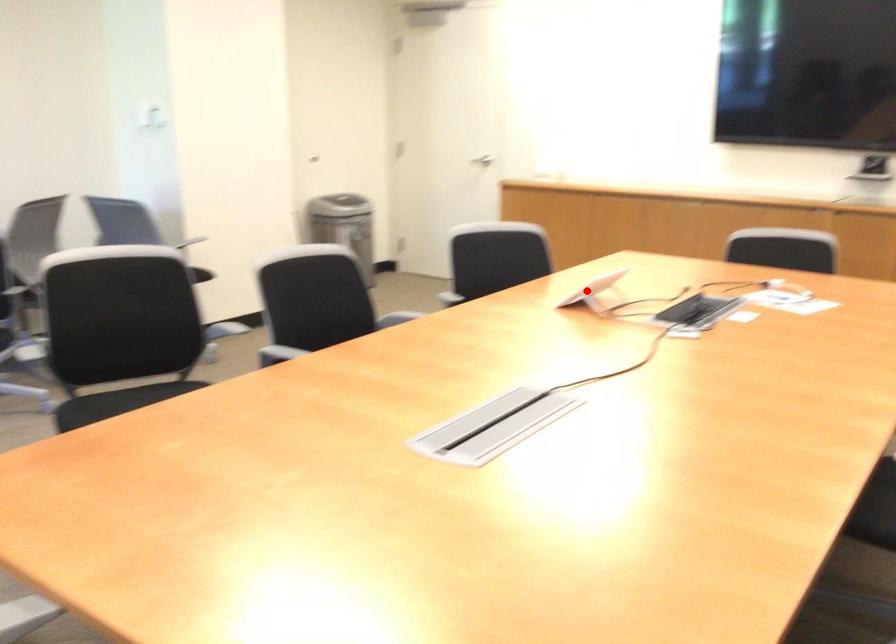
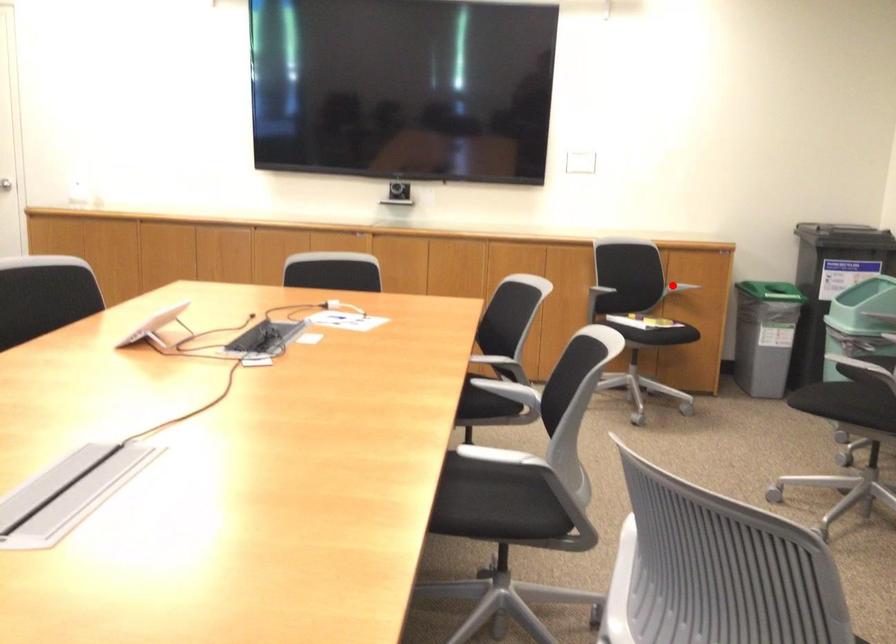
I am providing you with two images of the same scene from different viewpoints. A red point is marked on the first image and another point is marked on the second image. Is the red point in image1 aligned with the point shown in image2?

No